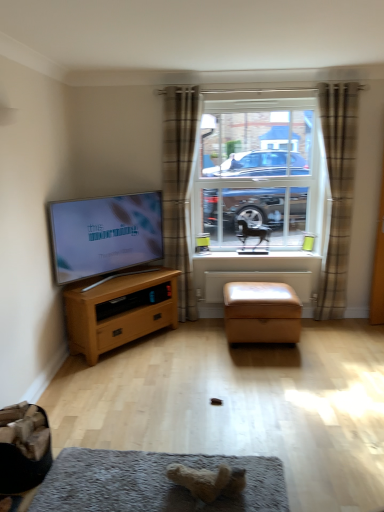
The height and width of the screenshot is (512, 384). I want to click on free point below matte black tv at left (from a real-world perspective), so click(x=120, y=273).